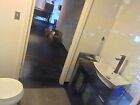
Look for where you'd pickup the toilet seat in the image and show me where they are. Your answer should be formatted as a list of tuples, i.e. [(x1, y1), (x2, y2), ...], where each tuple contains the x and y coordinates of a point satisfying the conditions above.

[(21, 87)]